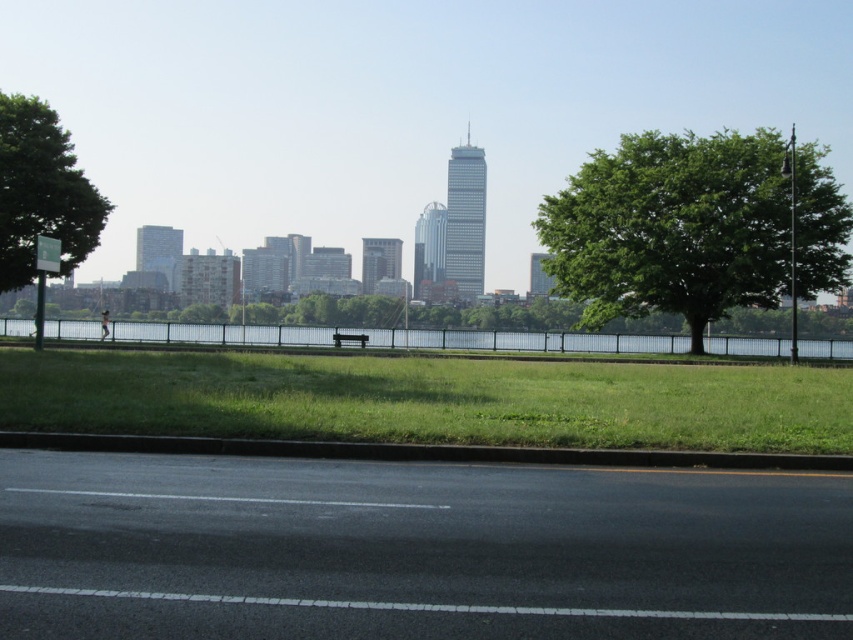
Question: Which point appears farthest from the camera in this image?

Choices:
 (A) (358, 333)
 (B) (705, 170)
 (C) (532, 336)
 (D) (302, 378)

Answer: (C)

Question: Observing the image, what is the correct spatial positioning of green grass at center in reference to green leafy tree at left?

Choices:
 (A) left
 (B) right

Answer: (B)

Question: Which point appears closest to the camera in this image?

Choices:
 (A) (340, 333)
 (B) (830, 276)

Answer: (B)

Question: Does clear water at center have a larger size compared to wooden park bench at center?

Choices:
 (A) yes
 (B) no

Answer: (A)

Question: Can you confirm if green grass at center is positioned above wooden park bench at center?

Choices:
 (A) yes
 (B) no

Answer: (B)

Question: Which point appears closest to the camera in this image?

Choices:
 (A) (807, 225)
 (B) (19, 252)
 (C) (619, 333)

Answer: (B)